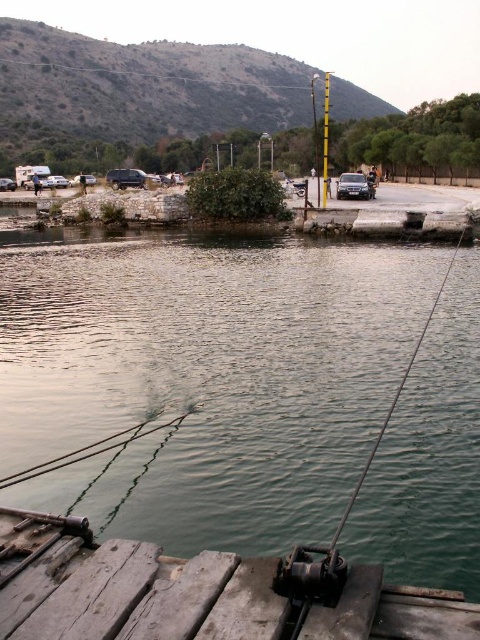
You are standing on the weathered wood dock at lower left and want to reach the yellow painted metal pole at center. Since the dock is narrower than the pole, will you have enough space to walk to the pole without stepping into the water?

The weathered wood dock at lower left has a lesser width compared to yellow painted metal pole at center. Therefore, you might not have enough space to walk to the pole without risking stepping into the water because the dock is narrower than the pole.

You are standing on the wooden platform and notice the greenish water at center and the yellow painted metal pole at center. Which object is closer to you?

The yellow painted metal pole at center is closer to you because the greenish water at center is positioned under it, indicating the pole is above the water.